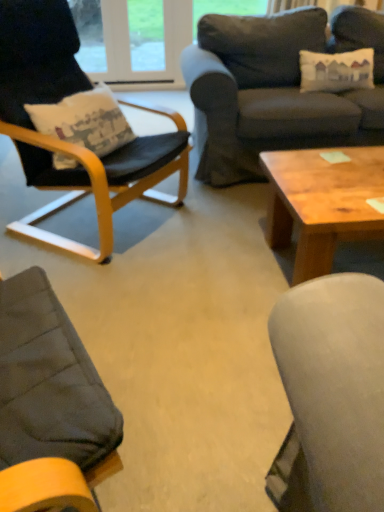
Question: Can you confirm if black leather chair at left is taller than dark gray fabric couch at upper right?

Choices:
 (A) no
 (B) yes

Answer: (B)

Question: From the image's perspective, is black leather chair at left located beneath dark gray fabric couch at upper right?

Choices:
 (A) no
 (B) yes

Answer: (B)

Question: Is black leather chair at left to the left of dark gray fabric couch at upper right from the viewer's perspective?

Choices:
 (A) no
 (B) yes

Answer: (B)

Question: Is black leather chair at left with dark gray fabric couch at upper right?

Choices:
 (A) yes
 (B) no

Answer: (B)

Question: Could you tell me if black leather chair at left is turned towards dark gray fabric couch at upper right?

Choices:
 (A) yes
 (B) no

Answer: (B)

Question: From a real-world perspective, is wooden coffee table at center above or below black leather chair at left?

Choices:
 (A) below
 (B) above

Answer: (A)

Question: Would you say wooden coffee table at center is to the left or to the right of black leather chair at left in the picture?

Choices:
 (A) right
 (B) left

Answer: (A)

Question: From their relative heights in the image, would you say wooden coffee table at center is taller or shorter than black leather chair at left?

Choices:
 (A) short
 (B) tall

Answer: (A)

Question: Which is correct: wooden coffee table at center is inside black leather chair at left, or outside of it?

Choices:
 (A) outside
 (B) inside

Answer: (A)

Question: Looking at the image, does wooden coffee table at center seem bigger or smaller compared to dark gray fabric couch at upper right?

Choices:
 (A) small
 (B) big

Answer: (A)

Question: Considering the positions of wooden coffee table at center and dark gray fabric couch at upper right in the image, is wooden coffee table at center taller or shorter than dark gray fabric couch at upper right?

Choices:
 (A) tall
 (B) short

Answer: (B)

Question: From a real-world perspective, is wooden coffee table at center positioned above or below dark gray fabric couch at upper right?

Choices:
 (A) below
 (B) above

Answer: (A)

Question: Is point (349, 200) closer or farther from the camera than point (259, 177)?

Choices:
 (A) closer
 (B) farther

Answer: (A)

Question: Is black leather chair at left taller or shorter than dark gray fabric couch at upper right?

Choices:
 (A) tall
 (B) short

Answer: (A)

Question: In terms of width, does black leather chair at left look wider or thinner when compared to dark gray fabric couch at upper right?

Choices:
 (A) wide
 (B) thin

Answer: (B)